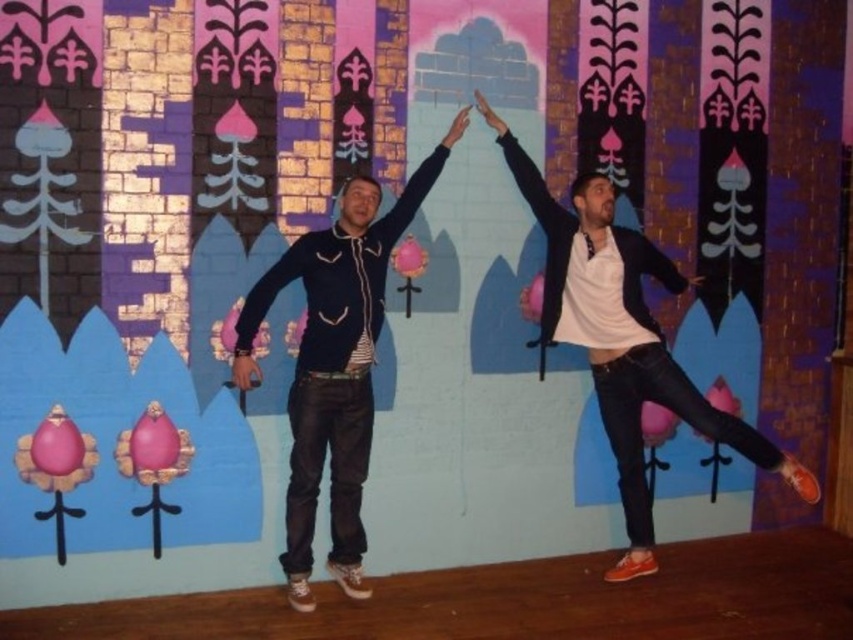
Is matte black jacket at center above matte black hoodie at center?

Yes.

Can you confirm if matte black jacket at center is positioned to the right of matte black hoodie at center?

Yes, matte black jacket at center is to the right of matte black hoodie at center.

Is point (743, 433) farther from viewer compared to point (303, 353)?

That is True.

Find the location of a particular element. The image size is (853, 640). matte black jacket at center is located at coordinates (624, 339).